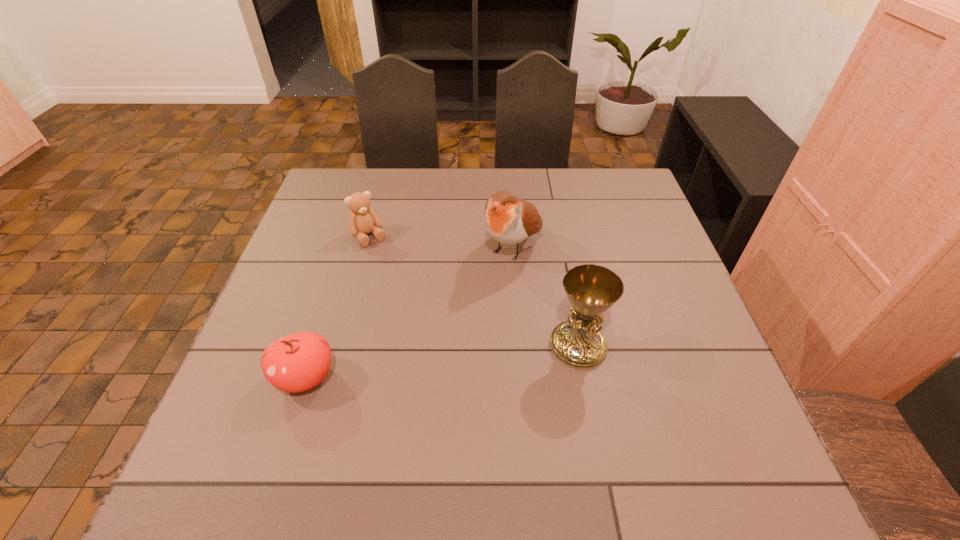
At what (x,y) coordinates should I click in order to perform the action: click on vacant area at the far left corner of the desktop. Please return your answer as a coordinate pair (x, y). This screenshot has width=960, height=540. Looking at the image, I should click on (333, 193).

This screenshot has height=540, width=960. Find the location of `vacant space at the near left corner`. vacant space at the near left corner is located at coordinates (269, 402).

This screenshot has height=540, width=960. In order to click on vacant area at the far right corner in this screenshot , I will do `click(636, 206)`.

You are a GUI agent. You are given a task and a screenshot of the screen. Output one action in this format:
    pyautogui.click(x=<x>, y=<y>)
    Task: Click on the vacant point located between the chalice and the bird
    The image size is (960, 540).
    Given the screenshot: What is the action you would take?
    pyautogui.click(x=545, y=296)

Where is `vacant point located between the apple and the teddy bear`? This screenshot has height=540, width=960. vacant point located between the apple and the teddy bear is located at coordinates (338, 307).

This screenshot has height=540, width=960. Identify the location of free space between the apple and the chalice. (442, 361).

The width and height of the screenshot is (960, 540). Identify the location of vacant area between the teddy bear and the apple. (338, 307).

Locate an element on the screen. vacant area between the bird and the apple is located at coordinates (409, 312).

Where is `vacant space that's between the chalice and the bird`? The image size is (960, 540). vacant space that's between the chalice and the bird is located at coordinates [x=545, y=296].

At what (x,y) coordinates should I click in order to perform the action: click on empty space that is in between the apple and the teddy bear. Please return your answer as a coordinate pair (x, y). The width and height of the screenshot is (960, 540). Looking at the image, I should click on (338, 307).